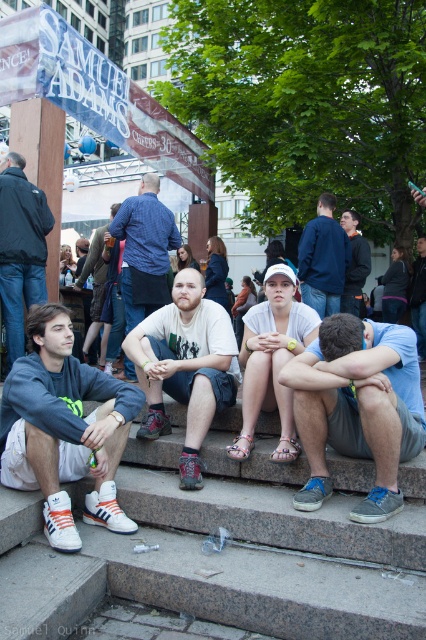
Question: Among these objects, which one is nearest to the camera?

Choices:
 (A) white cotton t-shirt at center
 (B) blue denim shirt at center
 (C) blue fabric shirt at lower right
 (D) blue denim jacket at center

Answer: (C)

Question: Which object is positioned closest to the dark gray jacket at center?

Choices:
 (A) blue denim jeans at center
 (B) granite steps at center
 (C) white adidas sneakers at lower left

Answer: (A)

Question: Is granite steps at center wider than white matte shirt at center?

Choices:
 (A) no
 (B) yes

Answer: (B)

Question: Which point is farther to the camera?

Choices:
 (A) granite steps at center
 (B) dark gray jacket at center

Answer: (B)

Question: Does white adidas sneakers at lower left have a greater width compared to dark gray jacket at center?

Choices:
 (A) yes
 (B) no

Answer: (A)

Question: Can you confirm if white adidas sneakers at lower left is thinner than blue denim shirt at center?

Choices:
 (A) yes
 (B) no

Answer: (A)